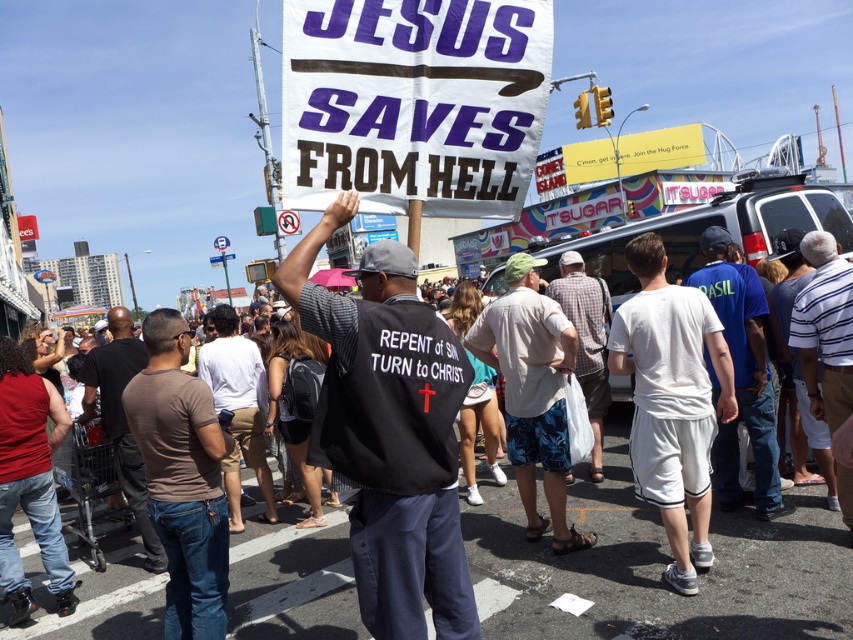
Question: Based on their relative distances, which object is nearer to the white cotton t-shirt at center?

Choices:
 (A) white cotton shirt at center
 (B) plaid fabric shirt at center
 (C) white striped shirt at center
 (D) light gray cotton shirt at center

Answer: (C)

Question: Can you confirm if black fabric jacket at center is positioned above white striped shirt at center?

Choices:
 (A) yes
 (B) no

Answer: (B)

Question: Which of the following is the farthest from the observer?

Choices:
 (A) (527, 467)
 (B) (148, 413)

Answer: (A)

Question: Is the position of brown cotton t-shirt at center more distant than that of brown leather jacket at center?

Choices:
 (A) yes
 (B) no

Answer: (B)

Question: Is black fabric jacket at center positioned in front of brown leather jacket at center?

Choices:
 (A) yes
 (B) no

Answer: (A)

Question: Which point appears closest to the camera in this image?

Choices:
 (A) (260, 518)
 (B) (555, 518)
 (C) (817, 384)
 (D) (712, 294)

Answer: (C)